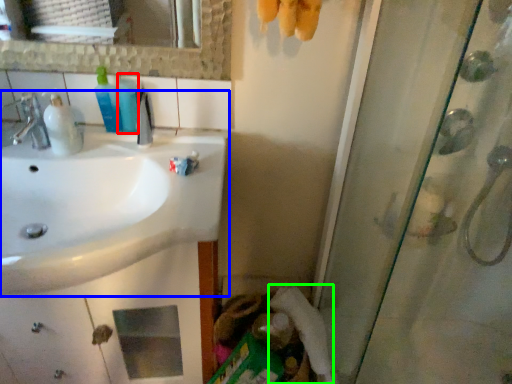
Question: Estimate the real-world distances between objects in this image. Which object is farther from mouthwash (highlighted by a red box), sink (highlighted by a blue box) or toilet paper (highlighted by a green box)?

Choices:
 (A) sink
 (B) toilet paper

Answer: (B)